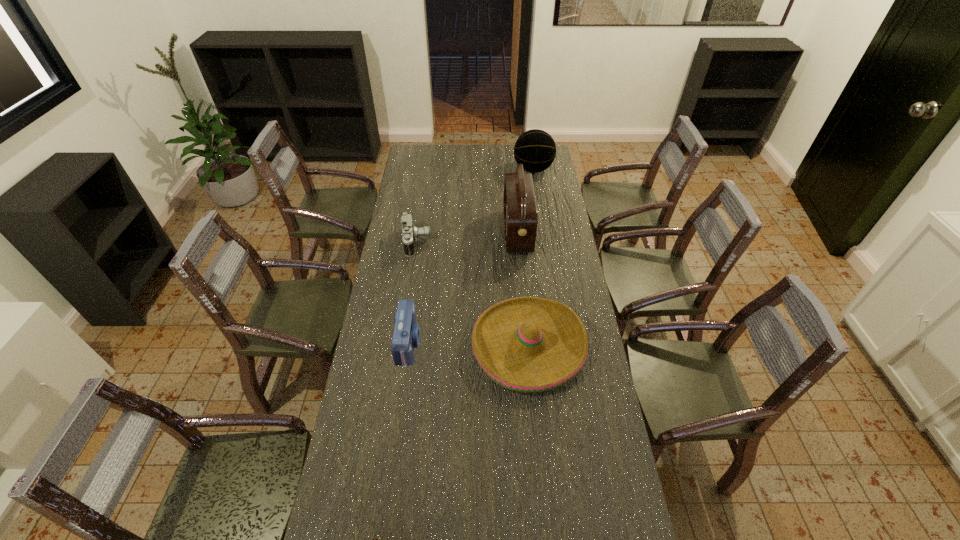
Where is `vacant space that is in between the sombrero and the second shortest camera`? The image size is (960, 540). vacant space that is in between the sombrero and the second shortest camera is located at coordinates (472, 294).

The image size is (960, 540). I want to click on free space between the second nearest camera and the sombrero, so click(x=468, y=345).

Where is `free spot between the tallest object and the tallest camera`? Image resolution: width=960 pixels, height=540 pixels. free spot between the tallest object and the tallest camera is located at coordinates (463, 287).

This screenshot has height=540, width=960. Find the location of `vacant space that's between the tallest object and the second shortest camera`. vacant space that's between the tallest object and the second shortest camera is located at coordinates (467, 237).

Identify the location of free space between the sombrero and the farthest camera. This screenshot has width=960, height=540. (472, 294).

What are the coordinates of `object that stands as the fourth closest to the fifth shortest object` in the screenshot? It's located at (406, 335).

Choose which object is the third nearest neighbor to the basketball. Please provide its 2D coordinates. Your answer should be formatted as a tuple, i.e. [(x, y)], where the tuple contains the x and y coordinates of a point satisfying the conditions above.

[(526, 344)]

At what (x,y) coordinates should I click in order to perform the action: click on camera that is the second closest to the shortest camera. Please return your answer as a coordinate pair (x, y). The width and height of the screenshot is (960, 540). Looking at the image, I should click on click(x=409, y=232).

Locate which camera is the closest to the sombrero. Please provide its 2D coordinates. Your answer should be formatted as a tuple, i.e. [(x, y)], where the tuple contains the x and y coordinates of a point satisfying the conditions above.

[(406, 335)]

Locate an element on the screen. The width and height of the screenshot is (960, 540). blank space that satisfies the following two spatial constraints: 1. on the front side of the basketball; 2. at the lens of the farthest camera is located at coordinates (544, 242).